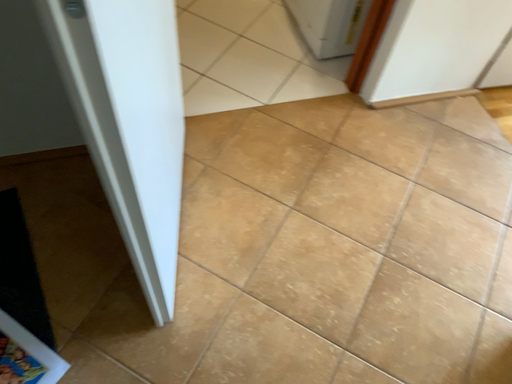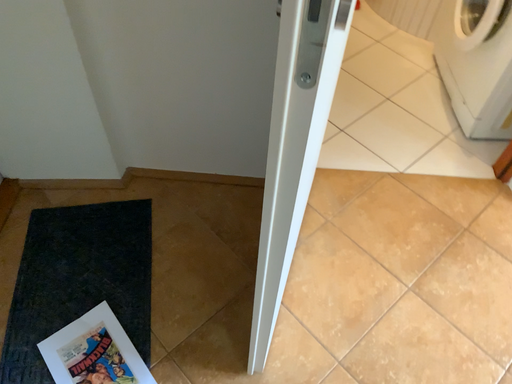
Question: How did the camera likely rotate when shooting the video?

Choices:
 (A) rotated right
 (B) rotated left

Answer: (B)